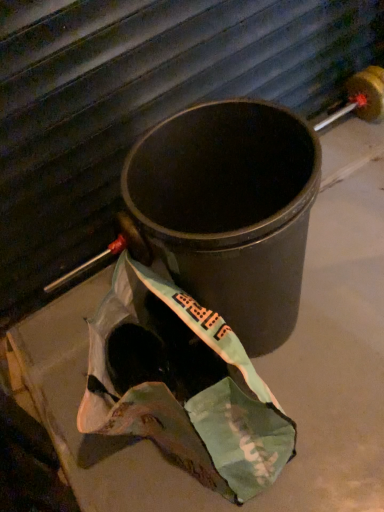
Where is `black matte trash can at center`? black matte trash can at center is located at coordinates (230, 210).

Based on the photo, measure the distance between point (258, 284) and camera.

The distance of point (258, 284) from camera is 34.21 inches.

This screenshot has width=384, height=512. What do you see at coordinates (230, 210) in the screenshot?
I see `black matte trash can at center` at bounding box center [230, 210].

Measure the distance between black matte trash can at center and camera.

black matte trash can at center and camera are 27.23 inches apart from each other.

Describe the element at coordinates (182, 386) in the screenshot. I see `teal fabric grocery bag at center` at that location.

Locate an element on the screen. teal fabric grocery bag at center is located at coordinates (182, 386).

Identify the location of black matte trash can at center. The width and height of the screenshot is (384, 512). (230, 210).

Which object is positioned more to the right, black matte trash can at center or teal fabric grocery bag at center?

black matte trash can at center.

Relative to teal fabric grocery bag at center, is black matte trash can at center in front or behind?

In the image, black matte trash can at center appears behind teal fabric grocery bag at center.

Does point (299, 201) appear closer or farther from the camera than point (213, 407)?

Point (299, 201) is closer to the camera than point (213, 407).

From the image's perspective, does black matte trash can at center appear higher than teal fabric grocery bag at center?

Yes, from the image's perspective, black matte trash can at center is above teal fabric grocery bag at center.

From a real-world perspective, which object stands above the other?

From a 3D spatial view, black matte trash can at center is above.

Can you confirm if black matte trash can at center is wider than teal fabric grocery bag at center?

Correct, the width of black matte trash can at center exceeds that of teal fabric grocery bag at center.

Which of these two, black matte trash can at center or teal fabric grocery bag at center, stands shorter?

teal fabric grocery bag at center is shorter.

Is black matte trash can at center bigger than teal fabric grocery bag at center?

Indeed, black matte trash can at center has a larger size compared to teal fabric grocery bag at center.

Can we say black matte trash can at center lies outside teal fabric grocery bag at center?

Yes, black matte trash can at center is not within teal fabric grocery bag at center.

Is black matte trash can at center far away from teal fabric grocery bag at center?

black matte trash can at center is near teal fabric grocery bag at center, not far away.

Does black matte trash can at center turn towards teal fabric grocery bag at center?

No, black matte trash can at center is not oriented towards teal fabric grocery bag at center.

How different are the orientations of black matte trash can at center and teal fabric grocery bag at center in degrees?

black matte trash can at center and teal fabric grocery bag at center are facing 102 degrees away from each other.

Measure the distance from black matte trash can at center to teal fabric grocery bag at center.

→ A distance of 8.90 inches exists between black matte trash can at center and teal fabric grocery bag at center.

Find the location of `grocery bag in front of the black matte trash can at center`. grocery bag in front of the black matte trash can at center is located at coordinates (182, 386).

Considering the positions of objects teal fabric grocery bag at center and black matte trash can at center in the image provided, who is more to the right, teal fabric grocery bag at center or black matte trash can at center?

Positioned to the right is black matte trash can at center.

Is teal fabric grocery bag at center positioned behind black matte trash can at center?

No, teal fabric grocery bag at center is closer to the viewer.

Which is in front, point (190, 298) or point (240, 131)?

The point (190, 298) is in front.

From the picture: From the image's perspective, is teal fabric grocery bag at center on black matte trash can at center?

Actually, teal fabric grocery bag at center appears below black matte trash can at center in the image.

Looking at this image, from a real-world perspective, is teal fabric grocery bag at center physically above black matte trash can at center?

No.

Which of these two, teal fabric grocery bag at center or black matte trash can at center, is wider?

With larger width is black matte trash can at center.

From their relative heights in the image, would you say teal fabric grocery bag at center is taller or shorter than black matte trash can at center?

Clearly, teal fabric grocery bag at center is shorter compared to black matte trash can at center.

In terms of size, does teal fabric grocery bag at center appear bigger or smaller than black matte trash can at center?

Clearly, teal fabric grocery bag at center is smaller in size than black matte trash can at center.

Can we say teal fabric grocery bag at center lies outside black matte trash can at center?

That's correct, teal fabric grocery bag at center is outside of black matte trash can at center.

Would you consider teal fabric grocery bag at center to be distant from black matte trash can at center?

They are positioned close to each other.

Is teal fabric grocery bag at center positioned with its back to black matte trash can at center?

That's not correct — teal fabric grocery bag at center is not looking away from black matte trash can at center.

How different are the orientations of teal fabric grocery bag at center and black matte trash can at center in degrees?

The facing directions of teal fabric grocery bag at center and black matte trash can at center are 102 degrees apart.

The height and width of the screenshot is (512, 384). I want to click on waste container positioned vertically above the teal fabric grocery bag at center (from a real-world perspective), so click(230, 210).

Identify the location of grocery bag on the left of black matte trash can at center. (182, 386).

There is a teal fabric grocery bag at center. Identify the location of waste container above it (from a real-world perspective). (230, 210).